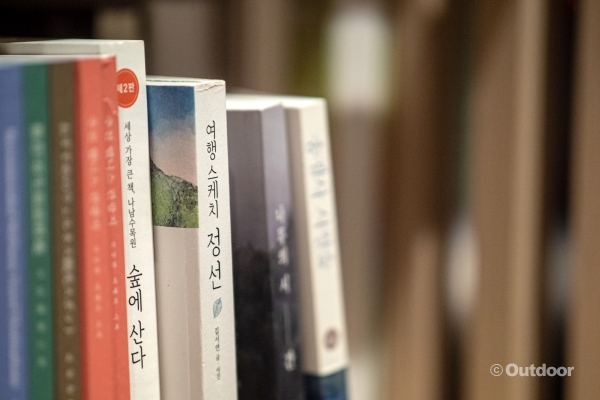
Where is `blurry books`? This screenshot has width=600, height=400. blurry books is located at coordinates (16, 266), (37, 260), (65, 260), (87, 250), (316, 186), (289, 189).